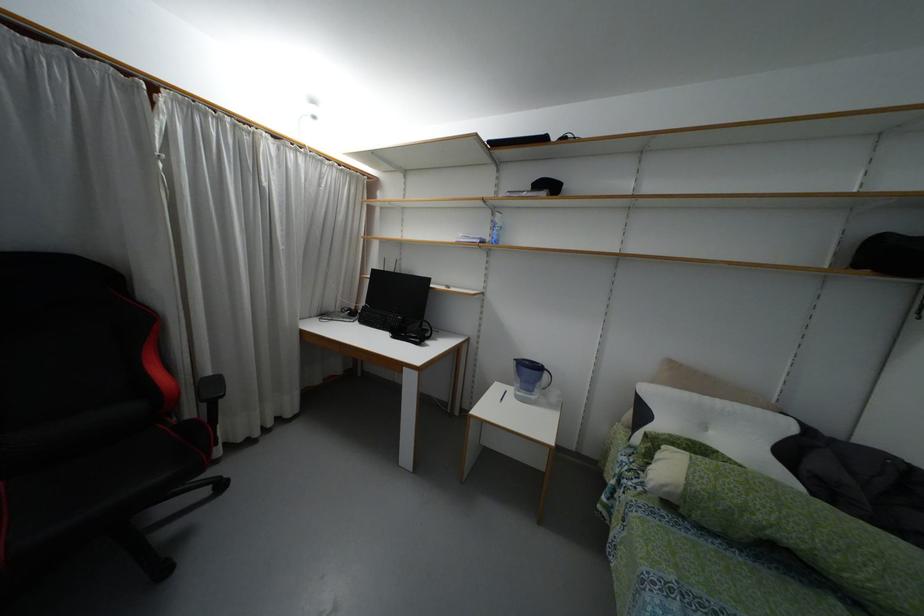
Which object does [494,227] point to?

This point indicates the blue water bottle.